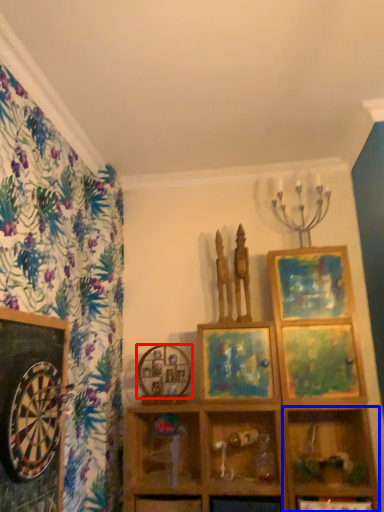
Question: Which object is closer to the camera taking this photo, picture frame (highlighted by a red box) or shelf (highlighted by a blue box)?

Choices:
 (A) picture frame
 (B) shelf

Answer: (B)